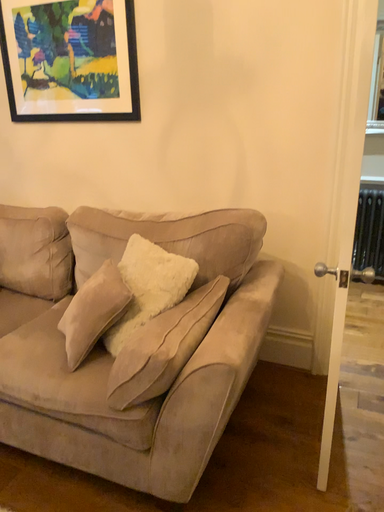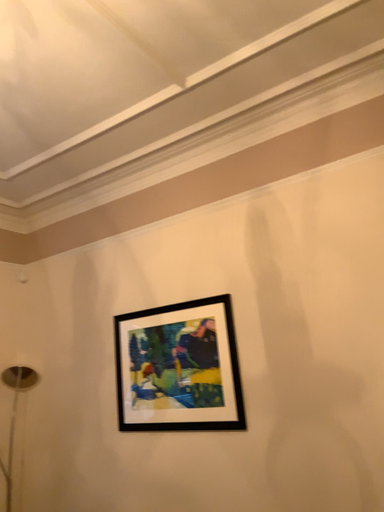
Question: How did the camera likely rotate when shooting the video?

Choices:
 (A) rotated downward
 (B) rotated upward

Answer: (B)